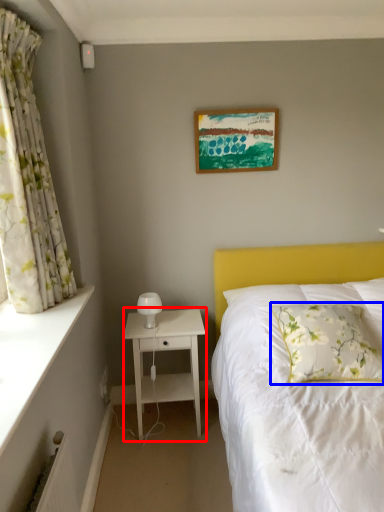
Question: Which object appears closest to the camera in this image, nightstand (highlighted by a red box) or pillow (highlighted by a blue box)?

Choices:
 (A) nightstand
 (B) pillow

Answer: (B)